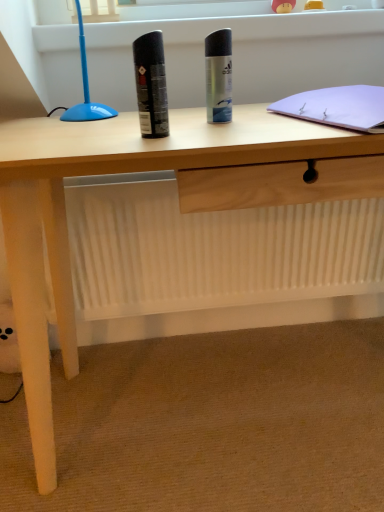
Question: In which direction should I rotate to look at silver metallic deodorant can at center, which is the first stationery from back to front?

Choices:
 (A) left
 (B) right

Answer: (B)

Question: From the image's perspective, is white paper notebook at upper right located beneath silver metallic deodorant can at center, arranged as the first stationery when viewed from the right?

Choices:
 (A) yes
 (B) no

Answer: (A)

Question: Is white paper notebook at upper right closer to the viewer compared to silver metallic deodorant can at center, which is the first stationery from back to front?

Choices:
 (A) no
 (B) yes

Answer: (B)

Question: Does white paper notebook at upper right have a lesser height compared to silver metallic deodorant can at center, arranged as the first stationery when viewed from the right?

Choices:
 (A) yes
 (B) no

Answer: (A)

Question: From a real-world perspective, is white paper notebook at upper right positioned over silver metallic deodorant can at center, the 2th stationery in the left-to-right sequence, based on gravity?

Choices:
 (A) yes
 (B) no

Answer: (B)

Question: Is white paper notebook at upper right not near silver metallic deodorant can at center, arranged as the first stationery when viewed from the right?

Choices:
 (A) yes
 (B) no

Answer: (B)

Question: Can you see white paper notebook at upper right touching silver metallic deodorant can at center, arranged as the first stationery when viewed from the right?

Choices:
 (A) yes
 (B) no

Answer: (B)

Question: Is white paper notebook at upper right bigger than black matte can at center, the 2th stationery viewed from the back?

Choices:
 (A) no
 (B) yes

Answer: (B)

Question: Is white paper notebook at upper right facing towards black matte can at center, positioned as the first stationery in left-to-right order?

Choices:
 (A) no
 (B) yes

Answer: (A)

Question: Are white paper notebook at upper right and black matte can at center, positioned as the first stationery in left-to-right order, beside each other?

Choices:
 (A) no
 (B) yes

Answer: (A)

Question: Would you say white paper notebook at upper right is outside black matte can at center, positioned as the first stationery in left-to-right order?

Choices:
 (A) yes
 (B) no

Answer: (A)

Question: Can you confirm if white paper notebook at upper right is smaller than black matte can at center, the 2th stationery viewed from the back?

Choices:
 (A) no
 (B) yes

Answer: (A)

Question: Is white paper notebook at upper right to the right of black matte can at center, the 2th stationery viewed from the back, from the viewer's perspective?

Choices:
 (A) no
 (B) yes

Answer: (B)

Question: Is black matte can at center, positioned as the first stationery in left-to-right order, positioned with its back to silver metallic deodorant can at center, which is the first stationery from back to front?

Choices:
 (A) yes
 (B) no

Answer: (B)